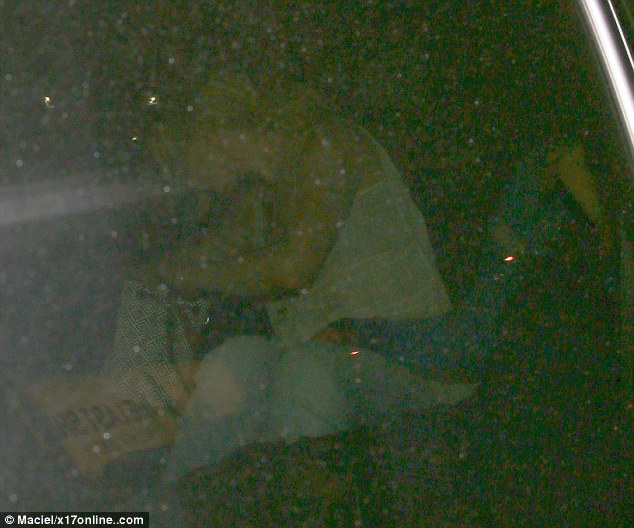
Image resolution: width=634 pixels, height=528 pixels. In order to click on possible window in this screenshot , I will do `click(513, 392)`.